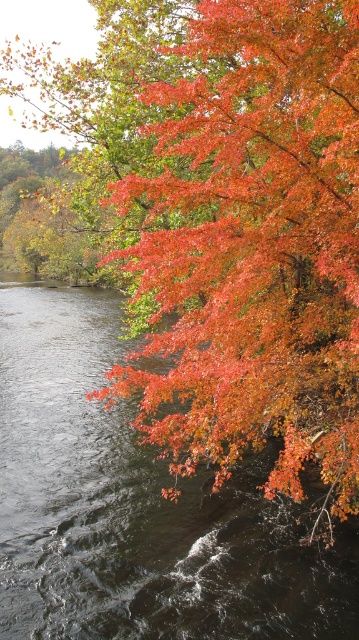
You are standing at the center of the riverbank and see the point marked at coordinates (253, 244). What color are the leaves located at that point?

The leaves at point (253, 244) are shiny orange.

You are a small boat that is 3 meters long. You are currently floating on the dark water at lower left and want to reach the shiny orange leaves at upper right. Can you safely navigate to them without getting stuck?

The distance between the shiny orange leaves at upper right and the dark water at lower left is 4.71 meters. Since your boat is 3 meters long, you can safely navigate to the shiny orange leaves at upper right as the distance is greater than the boat length, allowing enough space to move without getting stuck.